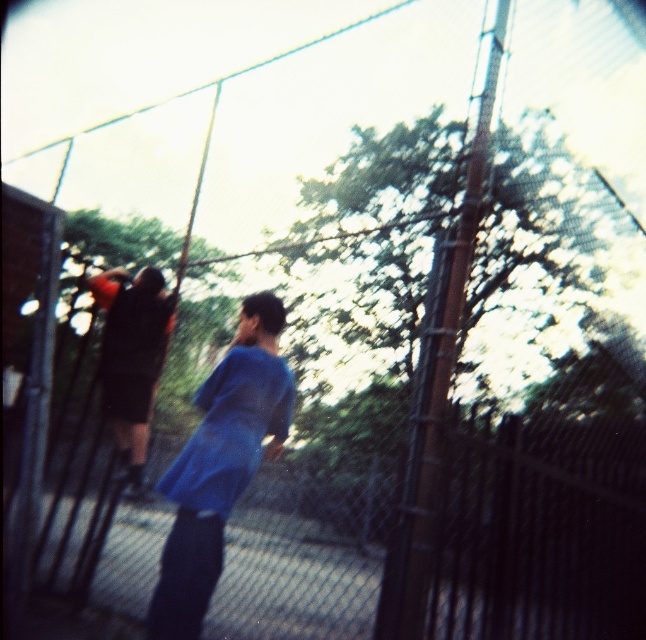
Between blue fabric shirt at center and dark blue shirt at center, which one has less height?

With less height is dark blue shirt at center.

Can you confirm if blue fabric shirt at center is positioned above dark blue shirt at center?

Incorrect, blue fabric shirt at center is not positioned above dark blue shirt at center.

You are a GUI agent. You are given a task and a screenshot of the screen. Output one action in this format:
    pyautogui.click(x=<x>, y=<y>)
    Task: Click on the blue fabric shirt at center
    This screenshot has height=640, width=646.
    Given the screenshot: What is the action you would take?
    pyautogui.click(x=220, y=465)